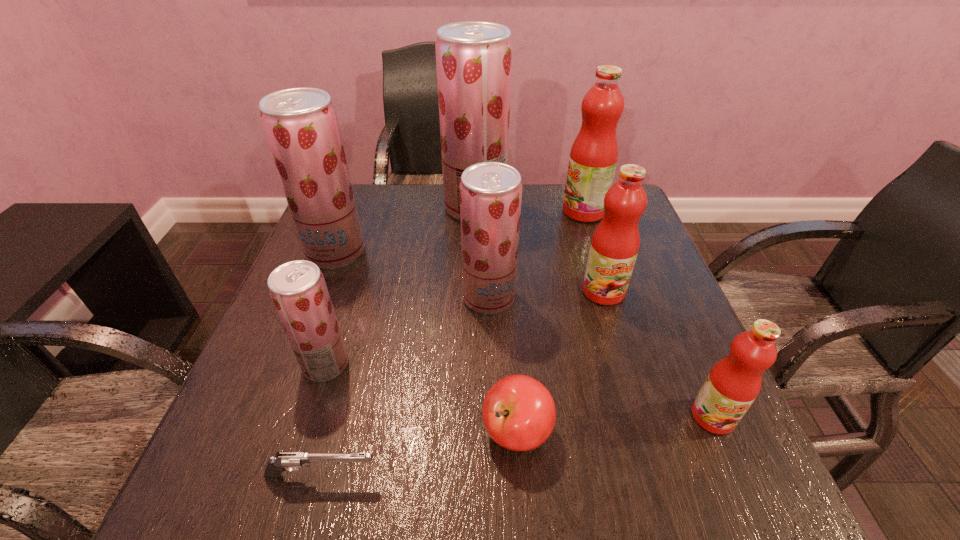
Where is `the biggest strawberry fruit juice`? This screenshot has width=960, height=540. the biggest strawberry fruit juice is located at coordinates coord(473,58).

Find the location of a particular element. The width and height of the screenshot is (960, 540). the tallest fruit juice is located at coordinates (473, 58).

The image size is (960, 540). Identify the location of the biggest pink fruit juice. (593, 158).

Where is `the second farthest strawberry fruit juice`? The width and height of the screenshot is (960, 540). the second farthest strawberry fruit juice is located at coordinates (301, 126).

At what (x,y) coordinates should I click in order to perform the action: click on the third farthest object. Please return your answer as a coordinate pair (x, y). The height and width of the screenshot is (540, 960). Looking at the image, I should click on (301, 126).

The image size is (960, 540). Identify the location of the second smallest pink fruit juice. (615, 243).

Locate an element on the screen. The height and width of the screenshot is (540, 960). the third biggest strawberry fruit juice is located at coordinates (490, 192).

Where is `the sixth farthest fruit juice`? Image resolution: width=960 pixels, height=540 pixels. the sixth farthest fruit juice is located at coordinates (298, 290).

The image size is (960, 540). Identify the location of the sixth farthest object. (298, 290).

Find the location of a particular element. The image size is (960, 540). the nearest fruit juice is located at coordinates (734, 382).